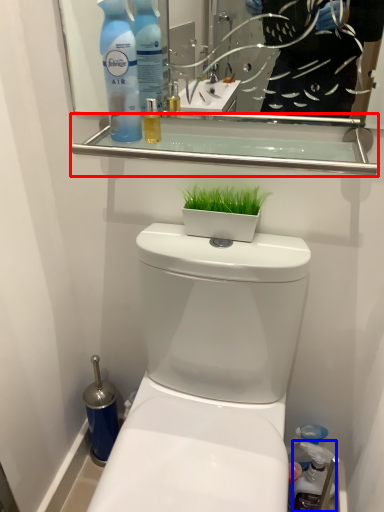
Question: Among these objects, which one is farthest to the camera, balustrade (highlighted by a red box) or cleaning product (highlighted by a blue box)?

Choices:
 (A) balustrade
 (B) cleaning product

Answer: (B)